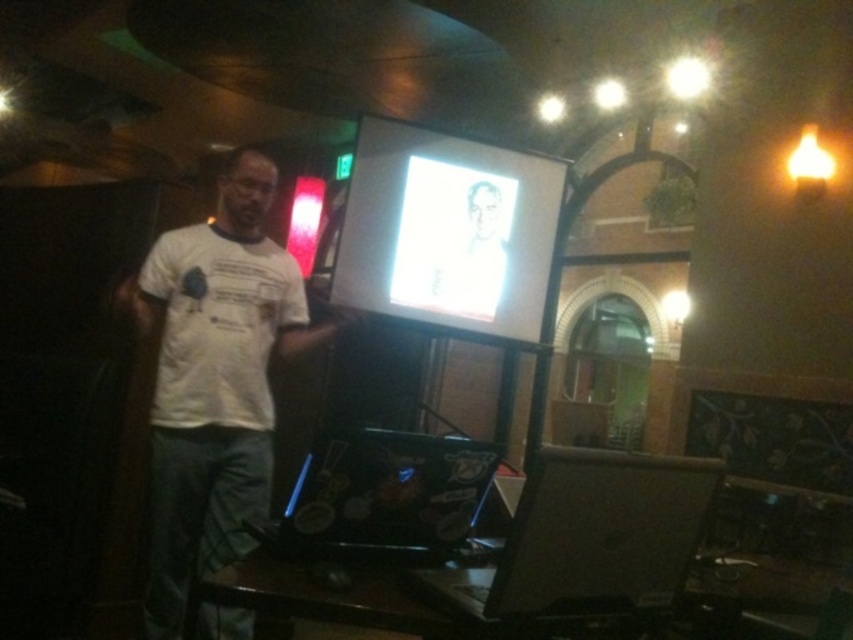
Question: Among these points, which one is farthest from the camera?

Choices:
 (A) (577, 534)
 (B) (486, 250)
 (C) (399, 525)

Answer: (B)

Question: Does white t-shirt at center have a lesser width compared to white glossy projection screen at center?

Choices:
 (A) no
 (B) yes

Answer: (B)

Question: Can you confirm if shiny black laptop at center is positioned below gray matte portrait at center?

Choices:
 (A) yes
 (B) no

Answer: (A)

Question: Which point is farther to the camera?

Choices:
 (A) (440, 266)
 (B) (370, 500)

Answer: (A)

Question: Does white t-shirt at center have a smaller size compared to black glossy laptop at lower center?

Choices:
 (A) no
 (B) yes

Answer: (A)

Question: Among these points, which one is farthest from the camera?

Choices:
 (A) (508, 579)
 (B) (467, 314)
 (C) (234, 260)

Answer: (B)